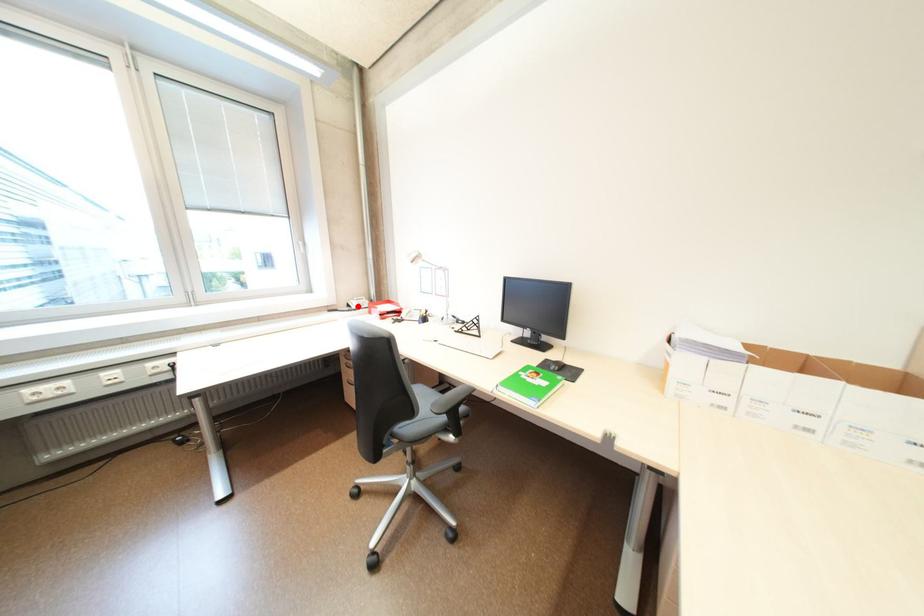
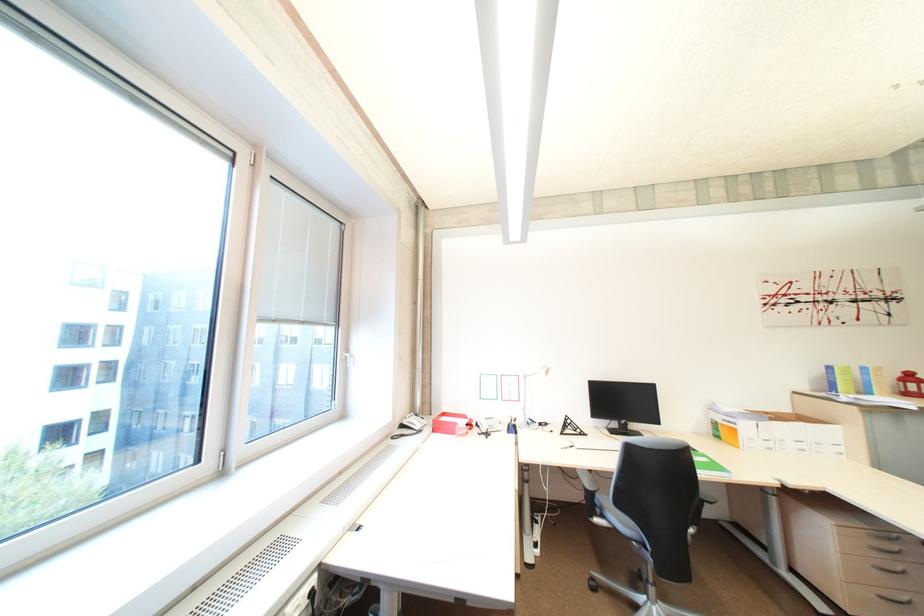
Find the pixel in the second image that matches the highlighted location in the first image.

(410, 427)